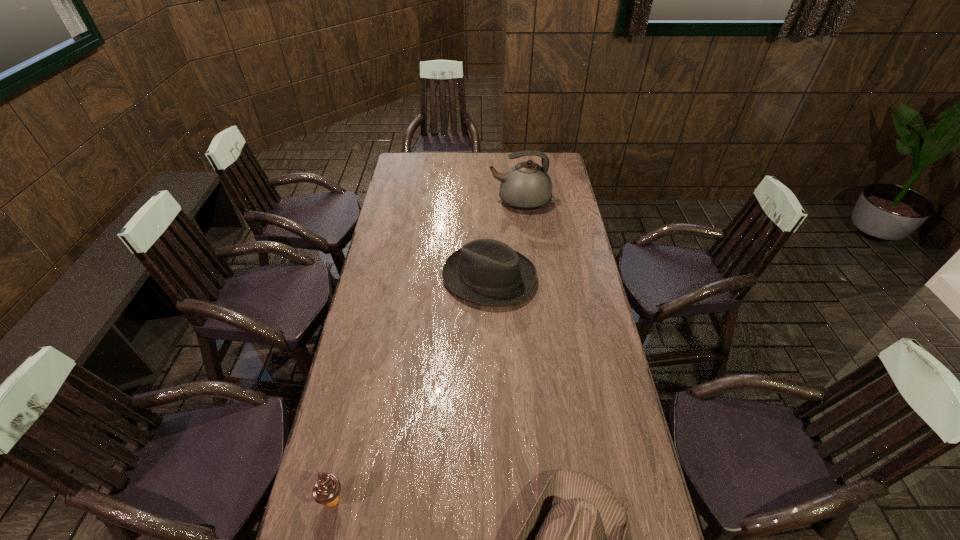
This screenshot has height=540, width=960. I want to click on object that is the second closest to the farthest object, so click(573, 539).

You are a GUI agent. You are given a task and a screenshot of the screen. Output one action in this format:
    pyautogui.click(x=<x>, y=<y>)
    Task: Click on the object that is the third nearest to the icecream
    This screenshot has height=540, width=960.
    Given the screenshot: What is the action you would take?
    pyautogui.click(x=526, y=186)

The image size is (960, 540). I want to click on vacant area in the image that satisfies the following two spatial constraints: 1. at the spout of the tallest object; 2. on the front side of the leftmost object, so click(x=553, y=500).